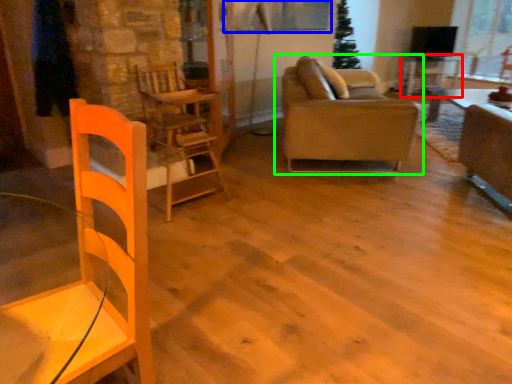
Question: Which is farther away from table (highlighted by a red box)? window screen (highlighted by a blue box) or studio couch (highlighted by a green box)?

Choices:
 (A) window screen
 (B) studio couch

Answer: (B)